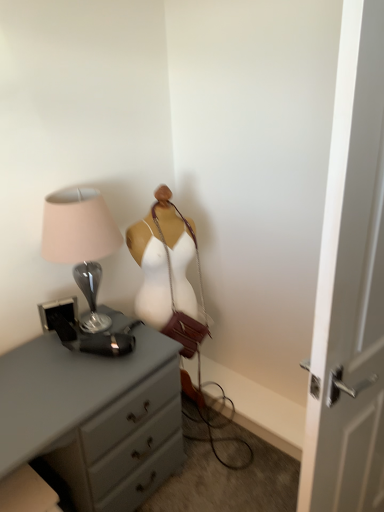
Measure the distance between point (144, 228) and camera.

Point (144, 228) is 5.51 feet from camera.

The image size is (384, 512). In order to click on white wooden door at right in this screenshot , I will do `click(350, 286)`.

Where is `the chest of drawers located underneath the white fabric mannequin at center (from a real-world perspective)`? Image resolution: width=384 pixels, height=512 pixels. the chest of drawers located underneath the white fabric mannequin at center (from a real-world perspective) is located at coordinates (94, 417).

From the image's perspective, would you say gray matte chest of drawers at left is shown under white fabric mannequin at center?

Yes, from the image's perspective, gray matte chest of drawers at left is beneath white fabric mannequin at center.

Is gray matte chest of drawers at left to the left or to the right of white fabric mannequin at center in the image?

gray matte chest of drawers at left is to the left of white fabric mannequin at center.

How much distance is there between gray matte chest of drawers at left and white fabric mannequin at center?

16.55 inches.

In the scene shown: Is white fabric mannequin at center a part of metallic glass lamp at left?

No.

From the picture: In terms of height, does metallic glass lamp at left look taller or shorter compared to white fabric mannequin at center?

Considering their sizes, metallic glass lamp at left has less height than white fabric mannequin at center.

Looking at their sizes, would you say metallic glass lamp at left is wider or thinner than white fabric mannequin at center?

In the image, metallic glass lamp at left appears to be wider than white fabric mannequin at center.

Is metallic glass lamp at left facing away from white fabric mannequin at center?

No, metallic glass lamp at left's orientation is not away from white fabric mannequin at center.

Which of these two, gray matte chest of drawers at left or white wooden door at right, stands taller?

With more height is white wooden door at right.

Based on the photo, which is farther from the camera, (37, 369) or (358, 453)?

Point (37, 369)

Which of these two, gray matte chest of drawers at left or white wooden door at right, is wider?

gray matte chest of drawers at left.

Is gray matte chest of drawers at left to the left of white wooden door at right from the viewer's perspective?

Yes, gray matte chest of drawers at left is to the left of white wooden door at right.

Is white fabric mannequin at center positioned beyond the bounds of metallic glass lamp at left?

Indeed, white fabric mannequin at center is completely outside metallic glass lamp at left.

In the scene shown: How much distance is there between white fabric mannequin at center and metallic glass lamp at left?

They are 9.96 inches apart.

Which is in front, point (204, 337) or point (86, 287)?

The point (86, 287) is closer to the camera.

Visually, is white fabric mannequin at center positioned to the left or to the right of metallic glass lamp at left?

In the image, white fabric mannequin at center appears on the right side of metallic glass lamp at left.

Between metallic glass lamp at left and white wooden door at right, which one has more height?

Standing taller between the two is white wooden door at right.

From a real-world perspective, is metallic glass lamp at left physically above white wooden door at right?

Correct, in the physical world, metallic glass lamp at left is higher than white wooden door at right.

Does point (106, 218) come closer to viewer compared to point (326, 252)?

No, (106, 218) is behind (326, 252).

From a real-world perspective, is metallic glass lamp at left beneath gray matte chest of drawers at left?

No, from a real-world perspective, metallic glass lamp at left is not beneath gray matte chest of drawers at left.

Is the position of metallic glass lamp at left more distant than that of gray matte chest of drawers at left?

Yes, it is.

Is metallic glass lamp at left bigger or smaller than gray matte chest of drawers at left?

Considering their sizes, metallic glass lamp at left takes up less space than gray matte chest of drawers at left.

How many degrees apart are the facing directions of white wooden door at right and metallic glass lamp at left?

The angle between the facing direction of white wooden door at right and the facing direction of metallic glass lamp at left is 10.7 degrees.

Is point (345, 495) closer to viewer compared to point (90, 242)?

Yes, it is in front of point (90, 242).

Is white wooden door at right directly adjacent to metallic glass lamp at left?

They are not placed beside each other.

From a real-world perspective, which is physically above, white wooden door at right or metallic glass lamp at left?

metallic glass lamp at left.

You are a GUI agent. You are given a task and a screenshot of the screen. Output one action in this format:
    pyautogui.click(x=<x>, y=<y>)
    Task: Click on the mannequin above the gray matte chest of drawers at left (from a real-world perspective)
    The width and height of the screenshot is (384, 512).
    Given the screenshot: What is the action you would take?
    pyautogui.click(x=167, y=273)

Where is `mannequin below the metallic glass lamp at left (from the image's perspective)`? mannequin below the metallic glass lamp at left (from the image's perspective) is located at coordinates (167, 273).

Considering their positions, is white wooden door at right positioned closer to gray matte chest of drawers at left than metallic glass lamp at left?

The object closer to gray matte chest of drawers at left is metallic glass lamp at left.

Looking at the image, which one is located closer to gray matte chest of drawers at left, metallic glass lamp at left or white fabric mannequin at center?

The object closer to gray matte chest of drawers at left is metallic glass lamp at left.

Considering their positions, is white fabric mannequin at center positioned closer to metallic glass lamp at left than gray matte chest of drawers at left?

Among the two, white fabric mannequin at center is located nearer to metallic glass lamp at left.

Based on their spatial positions, is white wooden door at right or white fabric mannequin at center closer to gray matte chest of drawers at left?

white fabric mannequin at center lies closer to gray matte chest of drawers at left than the other object.

Considering their positions, is metallic glass lamp at left positioned further to white wooden door at right than gray matte chest of drawers at left?

metallic glass lamp at left.

From the image, which object appears to be farther from white fabric mannequin at center, white wooden door at right or metallic glass lamp at left?

Based on the image, white wooden door at right appears to be further to white fabric mannequin at center.

Based on their spatial positions, is metallic glass lamp at left or white wooden door at right further from gray matte chest of drawers at left?

white wooden door at right lies further to gray matte chest of drawers at left than the other object.

Which object lies nearer to the anchor point gray matte chest of drawers at left, white fabric mannequin at center or metallic glass lamp at left?

metallic glass lamp at left is closer to gray matte chest of drawers at left.

Identify the location of mannequin between gray matte chest of drawers at left and white wooden door at right in the horizontal direction. The height and width of the screenshot is (512, 384). (167, 273).

The image size is (384, 512). I want to click on lamp between gray matte chest of drawers at left and white wooden door at right from left to right, so click(81, 242).

Where is `mannequin between metallic glass lamp at left and gray matte chest of drawers at left vertically`? mannequin between metallic glass lamp at left and gray matte chest of drawers at left vertically is located at coordinates (167, 273).

This screenshot has height=512, width=384. In order to click on lamp positioned between white wooden door at right and white fabric mannequin at center from near to far in this screenshot , I will do `click(81, 242)`.